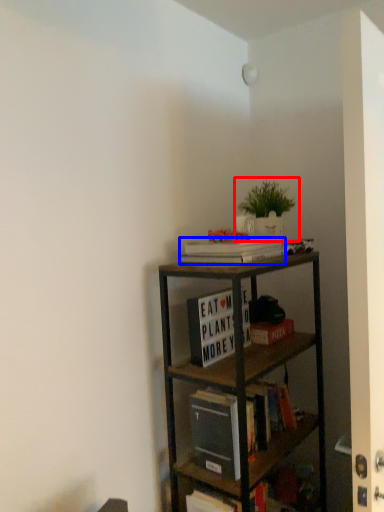
Question: Which object appears farthest to the camera in this image, houseplant (highlighted by a red box) or book (highlighted by a blue box)?

Choices:
 (A) houseplant
 (B) book

Answer: (A)